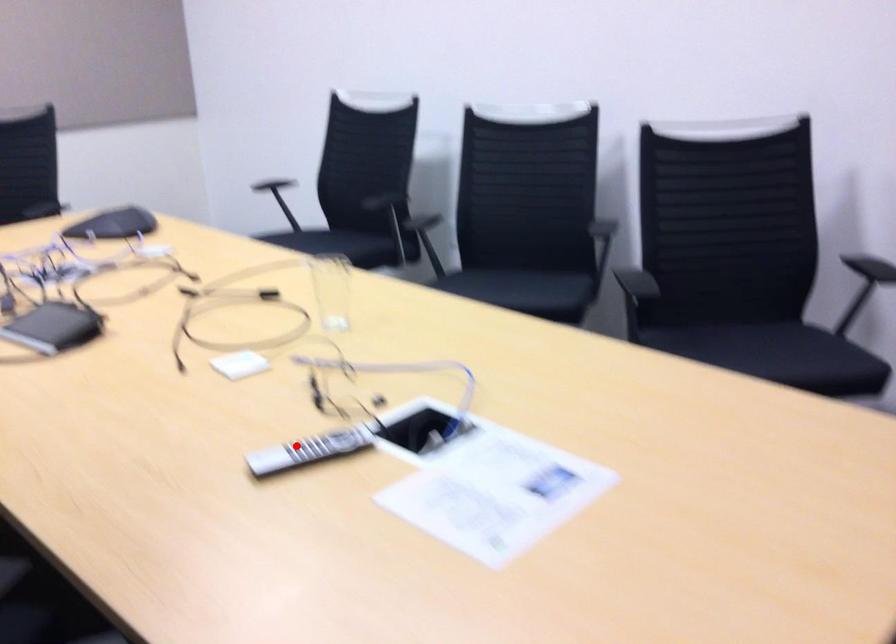
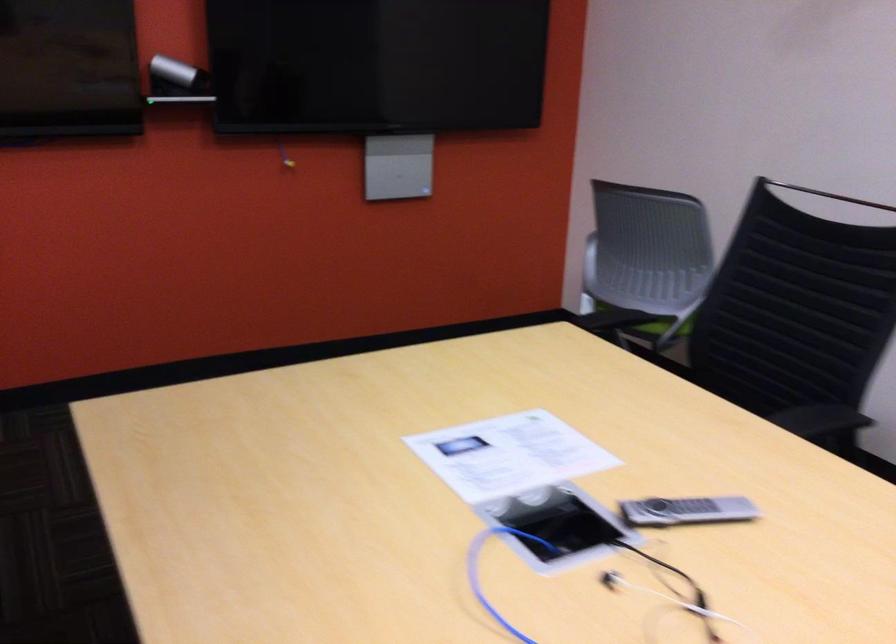
Question: I am providing you with two images of the same scene from different viewpoints. In image1, a red point is highlighted. Considering the same 3D point in image2, which of the following is correct?

Choices:
 (A) It is closer
 (B) It is farther

Answer: (A)